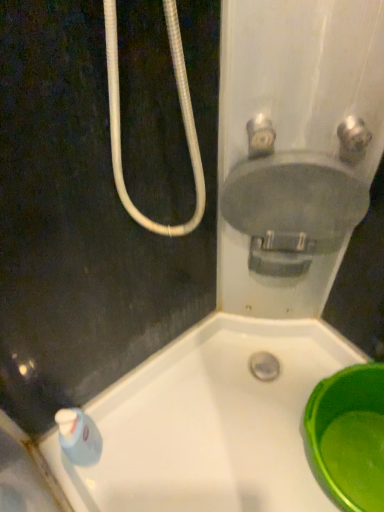
Question: Is matte gray sink at upper right inside the boundaries of satin nickel faucet at upper right, the first plumbing fixture in the right-to-left sequence, or outside?

Choices:
 (A) outside
 (B) inside

Answer: (A)

Question: From the image's perspective, is matte gray sink at upper right above or below satin nickel faucet at upper right, which is the second plumbing fixture in left-to-right order?

Choices:
 (A) below
 (B) above

Answer: (A)

Question: Estimate the real-world distances between objects in this image. Which object is farther from the matte gray sink at upper right?

Choices:
 (A) green plastic basin at lower right
 (B) satin nickel faucet at upper right, the first plumbing fixture in the right-to-left sequence
 (C) matte gray valve at upper right, acting as the second plumbing fixture starting from the right

Answer: (A)

Question: Which object is the farthest from the green plastic basin at lower right?

Choices:
 (A) satin nickel faucet at upper right, the first plumbing fixture in the right-to-left sequence
 (B) matte gray sink at upper right
 (C) matte gray valve at upper right, acting as the second plumbing fixture starting from the right

Answer: (C)